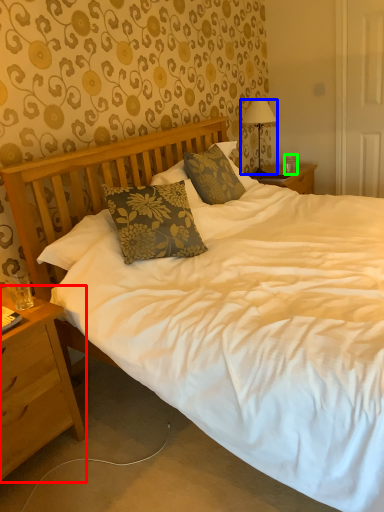
Question: Based on their relative distances, which object is nearer to nightstand (highlighted by a red box)? Choose from lamp (highlighted by a blue box) and coffee cup (highlighted by a green box).

Choices:
 (A) lamp
 (B) coffee cup

Answer: (A)